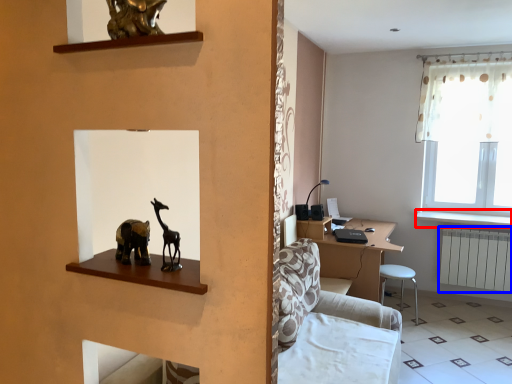
Question: Which point is closer to the camera, window sill (highlighted by a red box) or radiator (highlighted by a blue box)?

Choices:
 (A) window sill
 (B) radiator

Answer: (A)